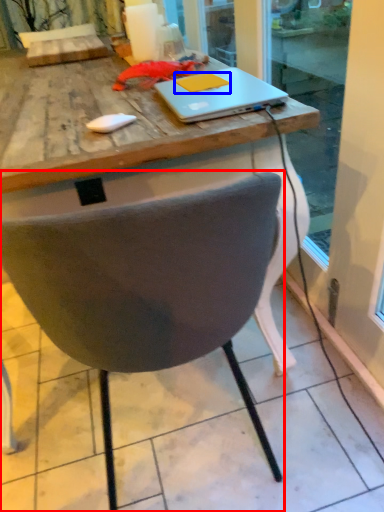
Question: Which of the following is the closest to the observer, chair (highlighted by a red box) or notepad (highlighted by a blue box)?

Choices:
 (A) chair
 (B) notepad

Answer: (A)